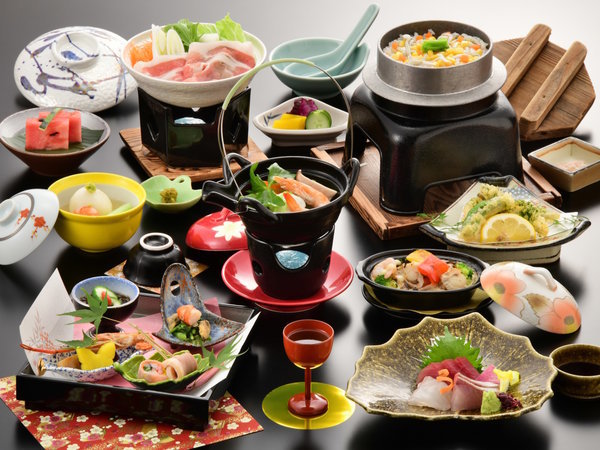
Where is `glass`? This screenshot has height=450, width=600. glass is located at coordinates (302, 383).